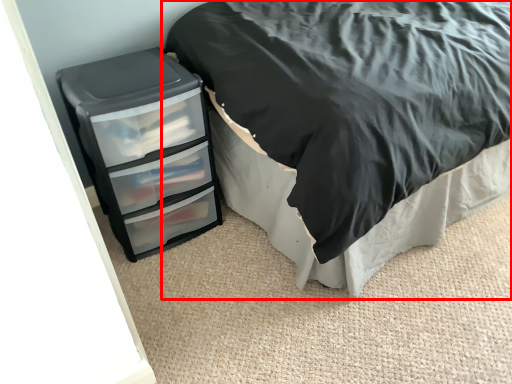
Question: From the image, what is the correct spatial relationship of bed (annotated by the red box) in relation to chest of drawers?

Choices:
 (A) left
 (B) right

Answer: (B)